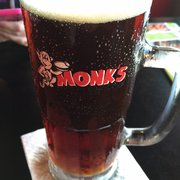
The image size is (180, 180). Identify the location of white napkin under beer mug. (33, 145).